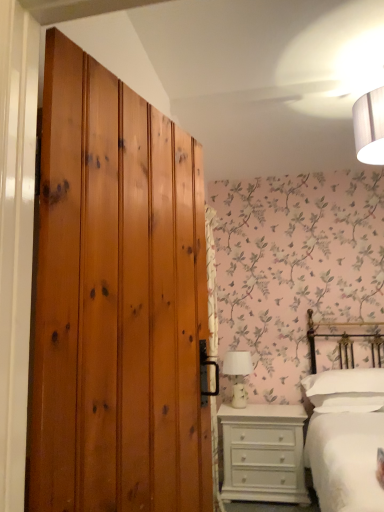
Locate an element on the screen. The image size is (384, 512). vacant region under white ceramic table lamp at center (from a real-world perspective) is located at coordinates (247, 406).